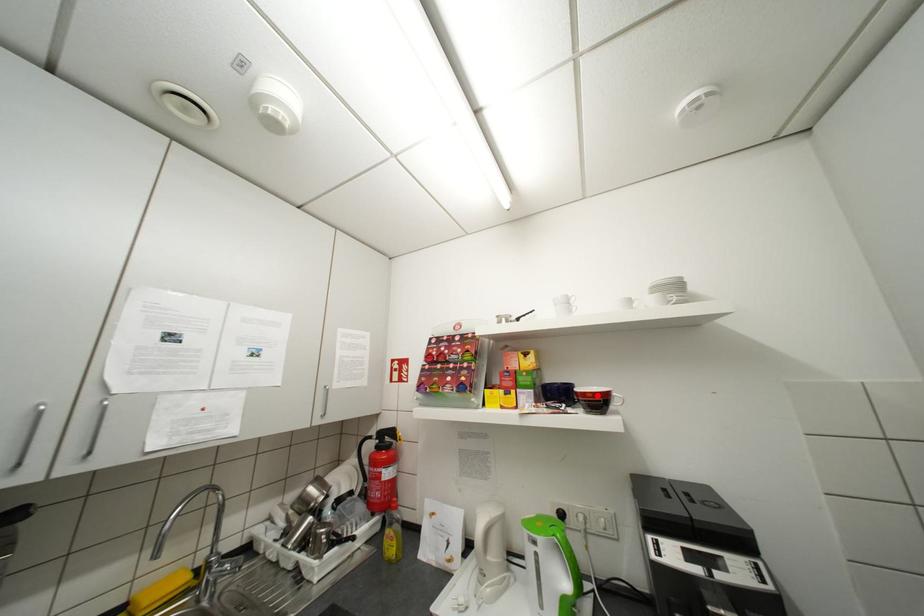
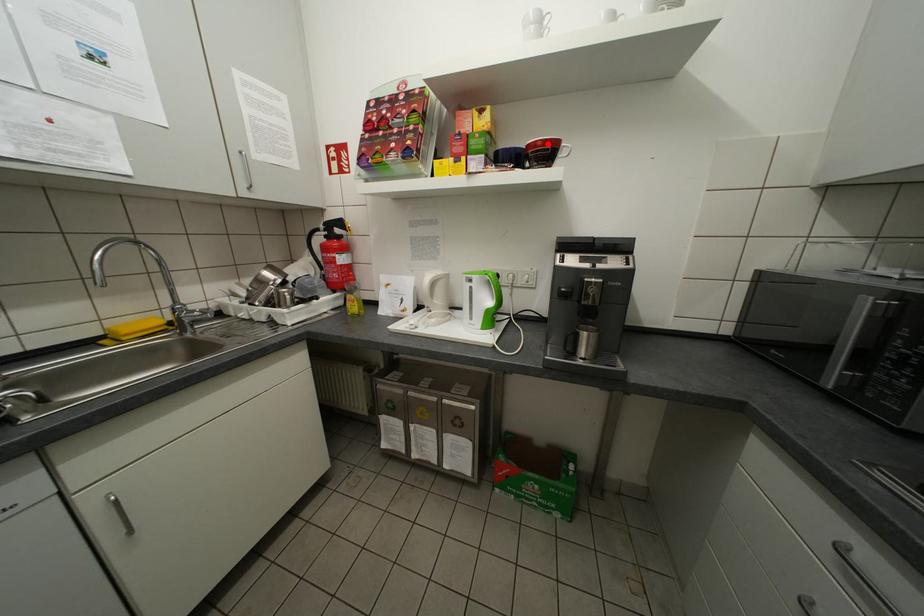
I am providing you with two images of the same scene from different viewpoints. A red point is marked on the first image and another point is marked on the second image. Does the point marked in image1 correspond to the same location as the one in image2?

Yes